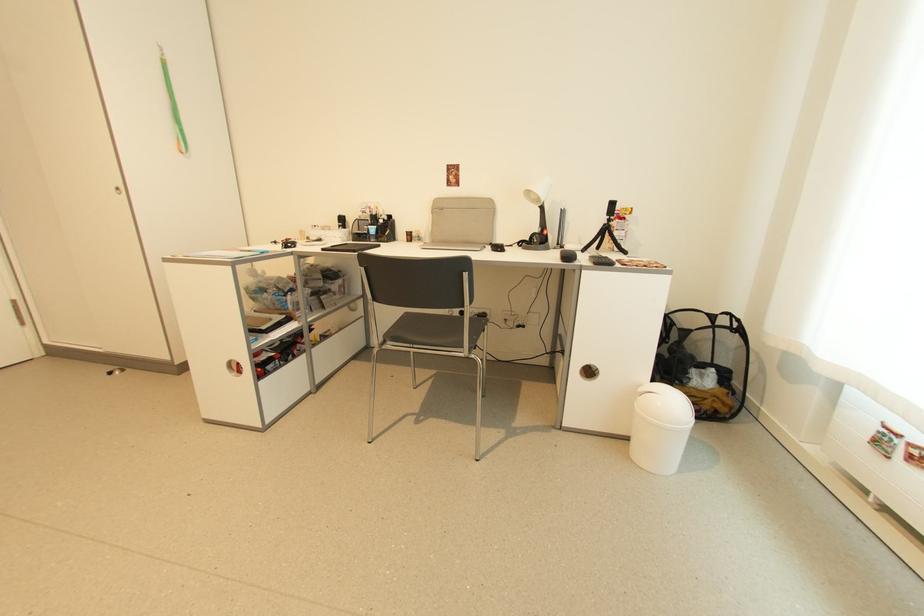
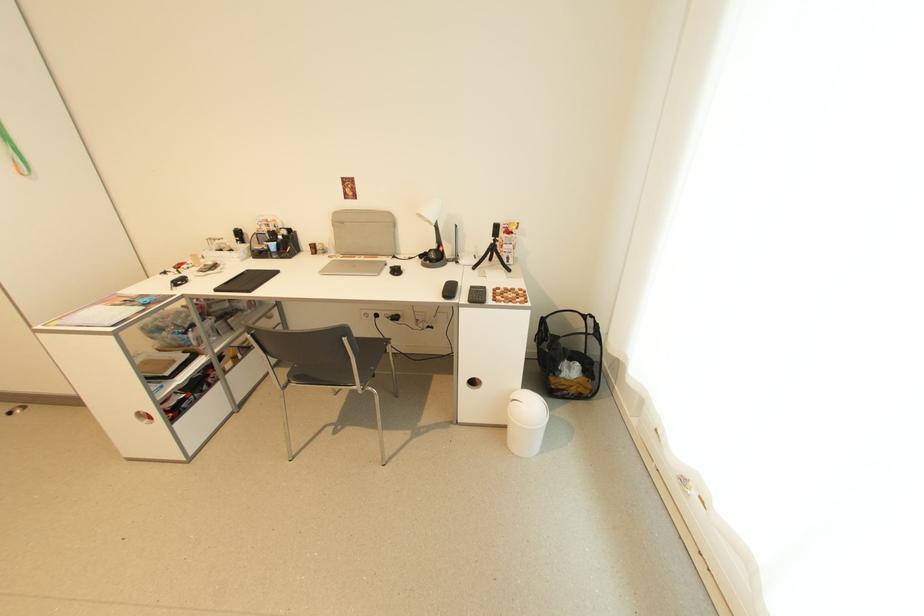
The point at (612, 217) is marked in the first image. Where is the corresponding point in the second image?

(497, 238)